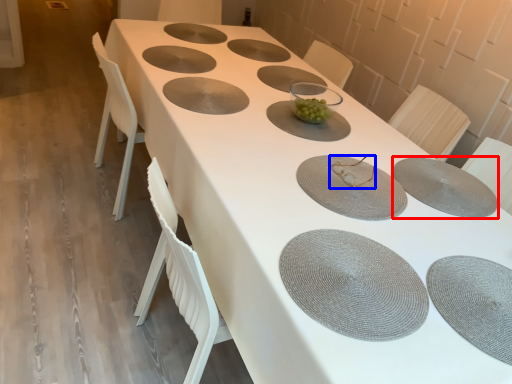
Question: Which object appears farthest to the camera in this image, tableware (highlighted by a red box) or tableware (highlighted by a blue box)?

Choices:
 (A) tableware
 (B) tableware

Answer: (B)